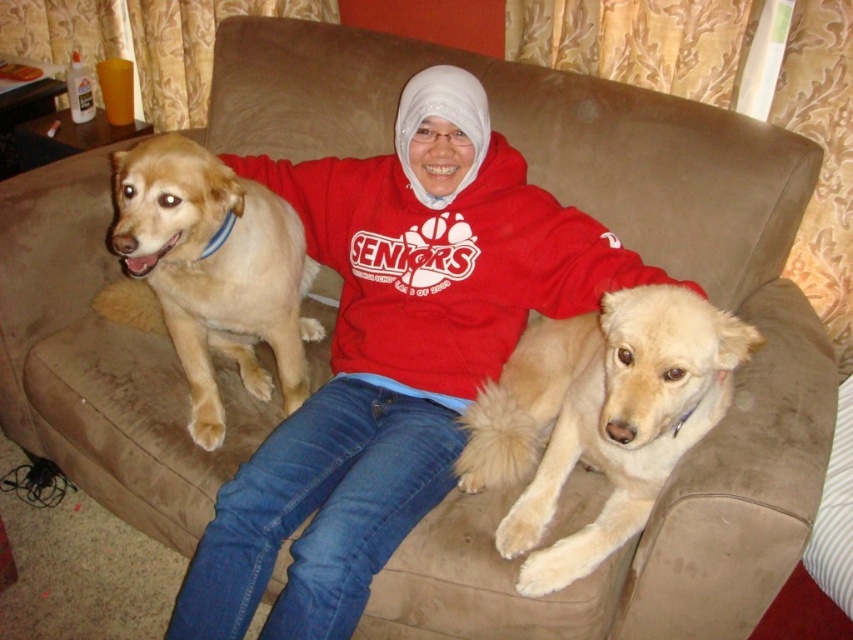
Is fuzzy beige dog at center to the right of golden fur dog at left from the viewer's perspective?

Correct, you'll find fuzzy beige dog at center to the right of golden fur dog at left.

Does fuzzy beige dog at center have a smaller size compared to golden fur dog at left?

Yes, fuzzy beige dog at center is smaller than golden fur dog at left.

I want to click on fuzzy beige dog at center, so click(599, 419).